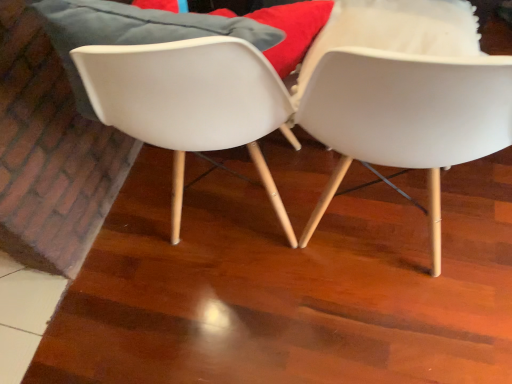
In order to click on free point to the left of white plastic chair at center, the first chair viewed from the left in this screenshot , I will do `click(136, 253)`.